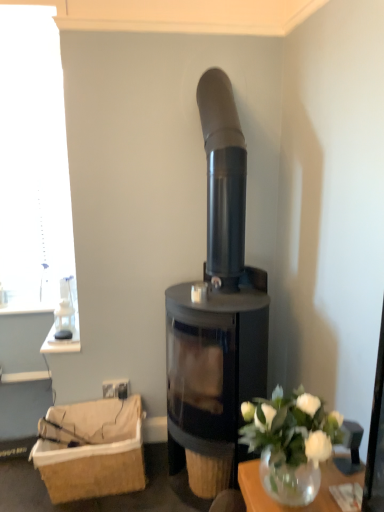
Question: From the image's perspective, is matte black wood burning stove at center positioned above or below brown woven basket at lower left?

Choices:
 (A) above
 (B) below

Answer: (A)

Question: Is point (203, 468) positioned closer to the camera than point (79, 421)?

Choices:
 (A) farther
 (B) closer

Answer: (B)

Question: Which is farther from the matte black wood burning stove at center?

Choices:
 (A) white glass vase at lower right
 (B) brown woven basket at lower left

Answer: (A)

Question: Estimate the real-world distances between objects in this image. Which object is farther from the matte black wood burning stove at center?

Choices:
 (A) white glass vase at lower right
 (B) brown woven basket at lower left

Answer: (A)